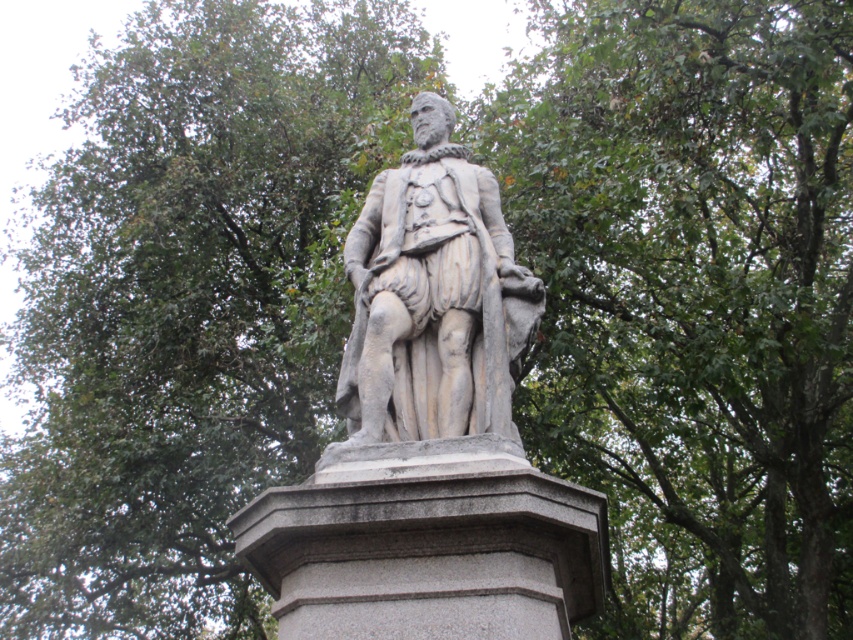
Question: Does gray granite pedestal at center lie in front of stone statue at center?

Choices:
 (A) no
 (B) yes

Answer: (B)

Question: Considering the relative positions of gray granite pedestal at center and stone statue at center in the image provided, where is gray granite pedestal at center located with respect to stone statue at center?

Choices:
 (A) below
 (B) above

Answer: (A)

Question: Is gray granite pedestal at center positioned at the back of stone statue at center?

Choices:
 (A) no
 (B) yes

Answer: (A)

Question: Which point is farther to the camera?

Choices:
 (A) gray granite pedestal at center
 (B) stone statue at center

Answer: (B)

Question: Which point is farther from the camera taking this photo?

Choices:
 (A) (x=357, y=307)
 (B) (x=505, y=592)

Answer: (A)